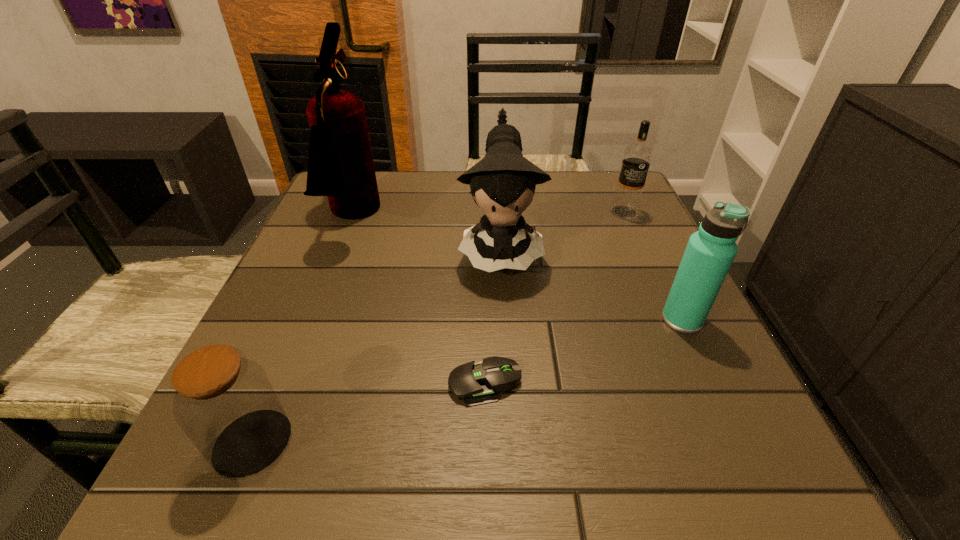
In order to click on blank space located on the front of the thermos bottle in this screenshot , I will do `click(756, 477)`.

This screenshot has width=960, height=540. In order to click on free space located 0.150m on the label of the vodka in this screenshot , I will do `click(646, 260)`.

Find the location of a particular element. free space located on the right of the second shortest object is located at coordinates (535, 443).

At what (x,y) coordinates should I click in order to perform the action: click on free space located on the back of the computer mouse. Please return your answer as a coordinate pair (x, y). The height and width of the screenshot is (540, 960). Looking at the image, I should click on (484, 310).

Locate an element on the screen. This screenshot has width=960, height=540. fire extinguisher that is at the far edge is located at coordinates (340, 165).

Find the location of `doll present at the far edge`. doll present at the far edge is located at coordinates (503, 182).

The height and width of the screenshot is (540, 960). I want to click on vodka that is at the far edge, so click(x=637, y=157).

Where is `object at the near edge`? object at the near edge is located at coordinates (224, 402).

The image size is (960, 540). What are the coordinates of `fire extinguisher that is at the left edge` in the screenshot? It's located at (340, 165).

Identify the location of jar present at the left edge. (224, 402).